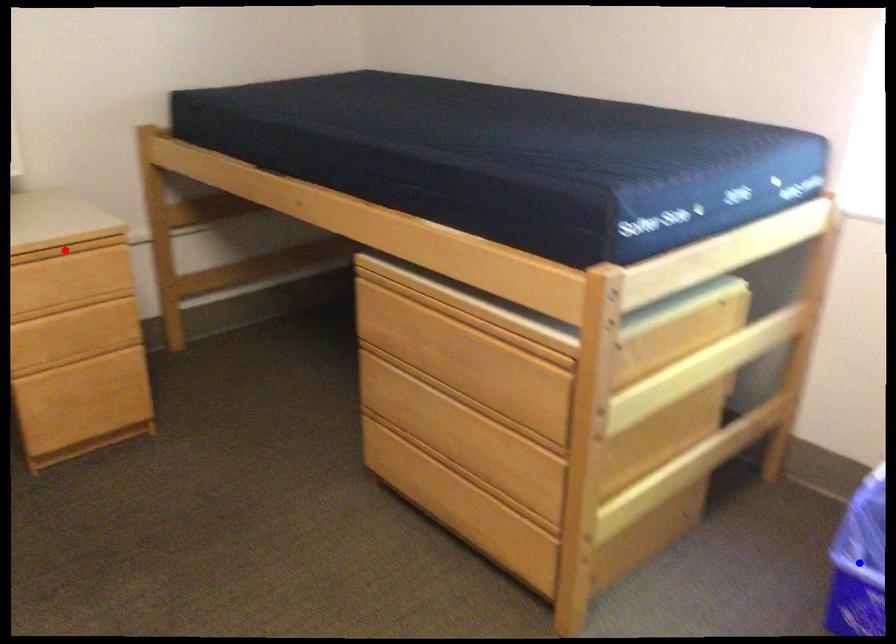
Question: Which of the two points in the image is closer to the camera?

Choices:
 (A) Blue point is closer.
 (B) Red point is closer.

Answer: (A)